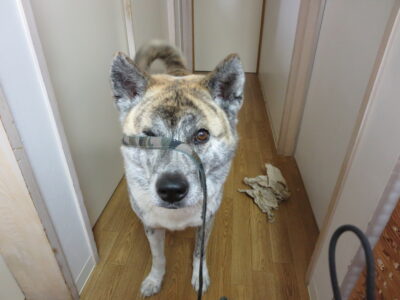
Locate an element on the screen. The image size is (400, 300). floor is located at coordinates (265, 276).